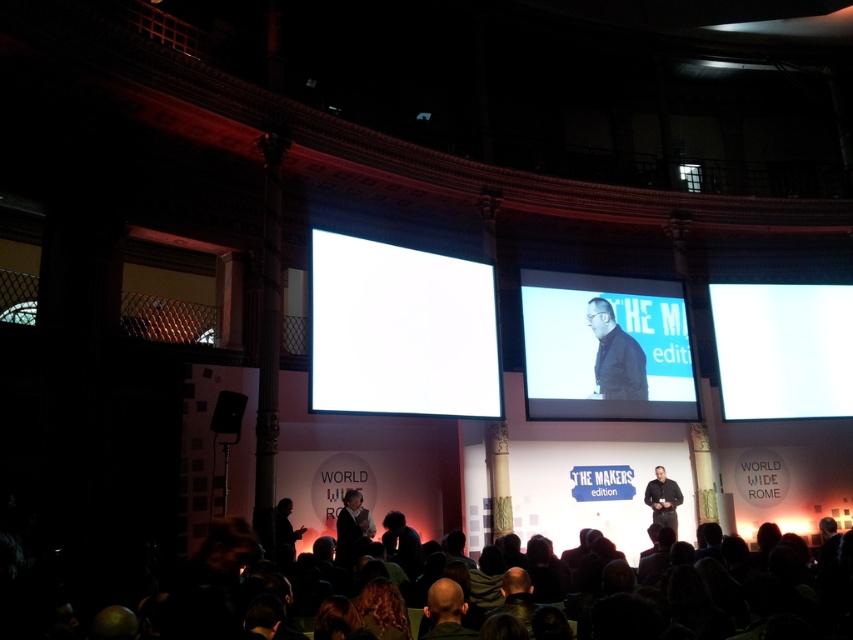
You are an event technician setting up for the presentation. You notice two screens on stage. The white matte projection screen at center and the white glossy projection screen at right. Which screen is closer to the audience?

The white matte projection screen at center is closer to the audience because it is positioned in front of the white glossy projection screen at right.

You are an event organizer who needs to adjust the stage lighting to ensure both the dark gray suit at lower left and the black matte speaker at lower left are clearly visible. Considering their heights, which object might require more focused lighting adjustments?

The dark gray suit at lower left has a lesser height compared to the black matte speaker at lower left, so the dark gray suit at lower left might require more focused lighting adjustments to ensure it is clearly visible from the audience perspective.

You are an event organizer at the Makers Edition conference. You need to arrange a photo shoot where the dark gray suit at lower left and the black matte speaker at lower left must be included. Which object should be placed closer to the camera to ensure both are visible in the photo?

The dark gray suit at lower left is smaller than the black matte speaker at lower left, so to ensure both are visible in the photo, the dark gray suit at lower left should be placed closer to the camera.